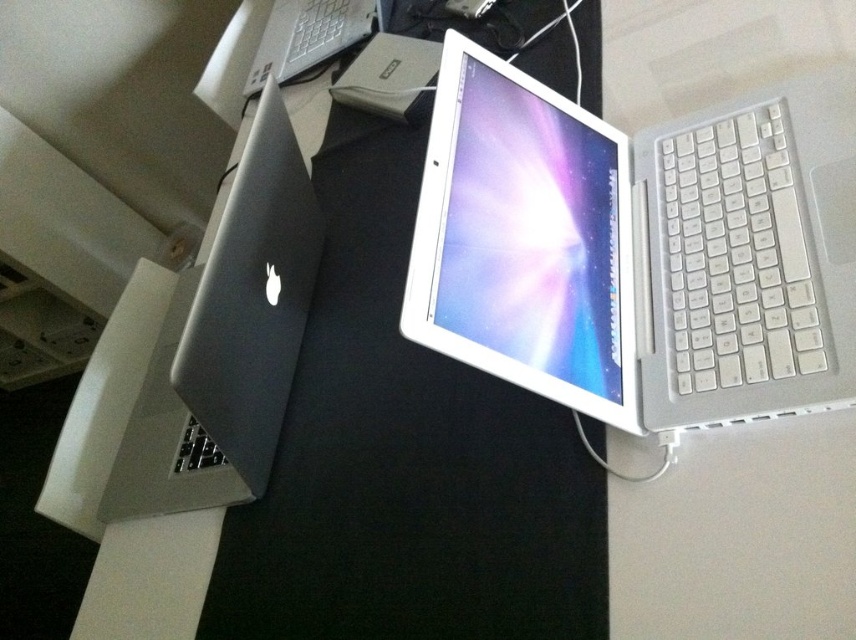
Question: Which point is farther from the camera taking this photo?

Choices:
 (A) (263, 385)
 (B) (819, 310)
 (C) (352, 33)

Answer: (C)

Question: Is the position of white plastic laptop at center more distant than that of white plastic keyboard at right?

Choices:
 (A) no
 (B) yes

Answer: (A)

Question: Among these objects, which one is nearest to the camera?

Choices:
 (A) white plastic laptop at upper center
 (B) satin silver laptop at left
 (C) white plastic keyboard at right
 (D) white plastic laptop at center

Answer: (D)

Question: Does satin silver laptop at left appear on the left side of white plastic keyboard at right?

Choices:
 (A) no
 (B) yes

Answer: (B)

Question: Estimate the real-world distances between objects in this image. Which object is farther from the white plastic laptop at upper center?

Choices:
 (A) satin silver laptop at left
 (B) white plastic keyboard at right
 (C) white plastic laptop at center

Answer: (B)

Question: Does white plastic keyboard at right appear on the right side of white plastic laptop at upper center?

Choices:
 (A) no
 (B) yes

Answer: (B)